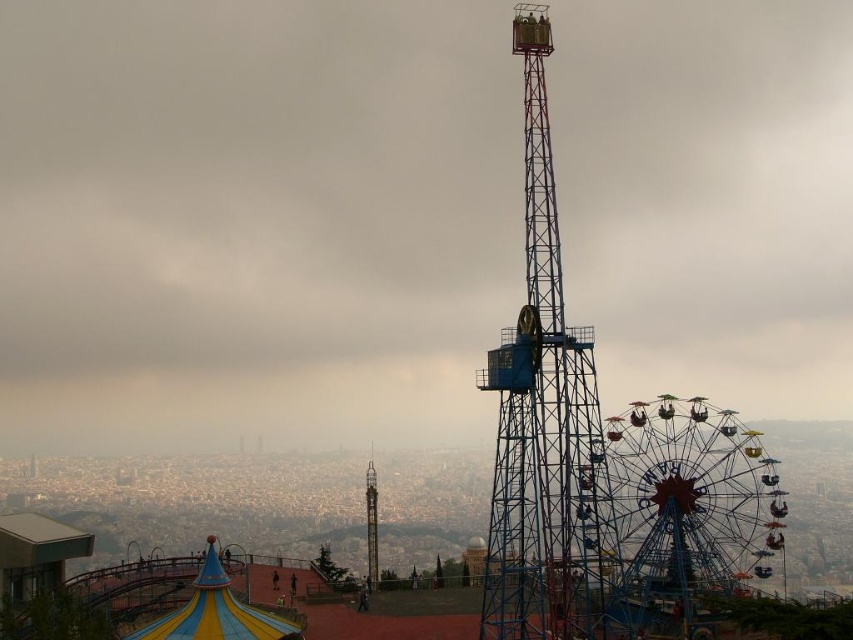
You are standing in the amusement park and looking at two points in the scene. The first point is at coordinates point (393, 472) and the second point is at point (367, 465). Which of these two points is closer to your current position?

Point (393, 472) is closer to the camera than point (367, 465), so the first point is closer to your current position.

Looking at this image, you are standing at the entrance of the amusement park and see both the metallic ferris wheel at center and the blue metallic tower at center. Which one is positioned more to the left side?

The metallic ferris wheel at center is positioned more to the left side than the blue metallic tower at center.

You are standing at the center of the amusement park and want to locate the metallic ferris wheel at center. According to the coordinates provided, where exactly is it positioned?

The metallic ferris wheel at center is located at point 0.784 on the x axis and 0.234 on the y axis.